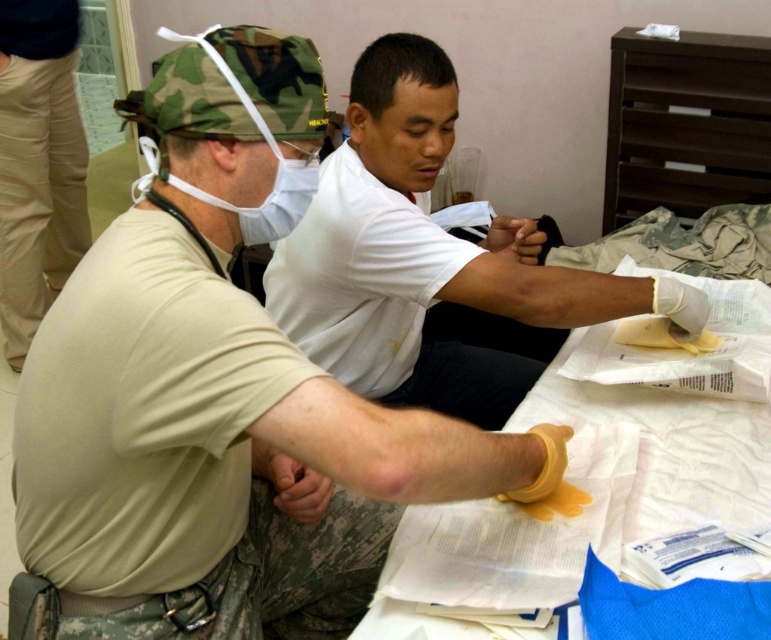
Which of these two, yellow rubber glove at lower center or tan cotton pants at lower left, stands shorter?

yellow rubber glove at lower center

Does yellow rubber glove at lower center have a larger size compared to tan cotton pants at lower left?

Correct, yellow rubber glove at lower center is larger in size than tan cotton pants at lower left.

You are a GUI agent. You are given a task and a screenshot of the screen. Output one action in this format:
    pyautogui.click(x=<x>, y=<y>)
    Task: Click on the yellow rubber glove at lower center
    The width and height of the screenshot is (771, 640).
    Given the screenshot: What is the action you would take?
    pyautogui.click(x=217, y=394)